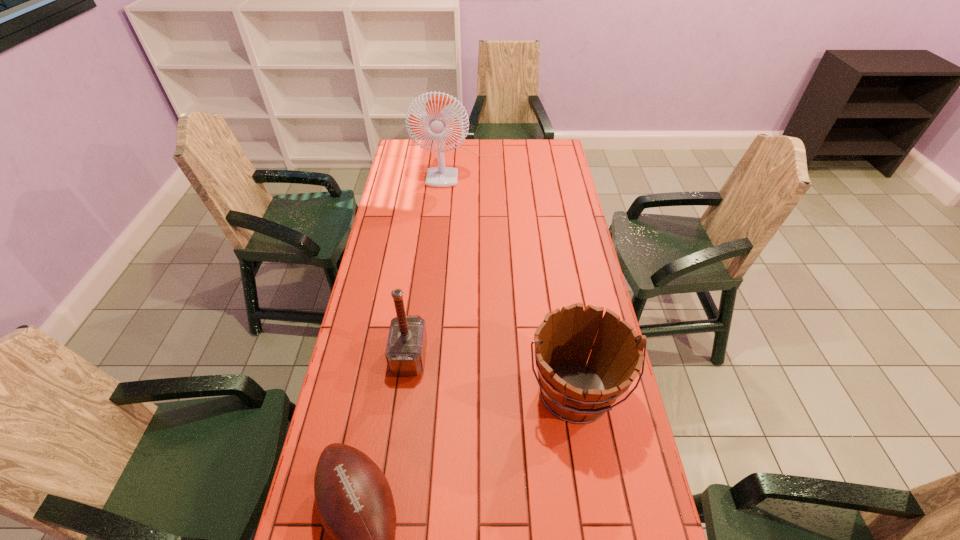
At what (x,y) coordinates should I click in order to perform the action: click on object present at the right edge. Please return your answer as a coordinate pair (x, y). This screenshot has height=540, width=960. Looking at the image, I should click on (576, 391).

You are a GUI agent. You are given a task and a screenshot of the screen. Output one action in this format:
    pyautogui.click(x=<x>, y=<y>)
    Task: Click on the object that is at the far left corner
    The height and width of the screenshot is (540, 960).
    Given the screenshot: What is the action you would take?
    pyautogui.click(x=441, y=176)

Identify the location of vacant space at the far edge of the desktop. (511, 143).

Locate an element on the screen. free space at the left edge of the desktop is located at coordinates (383, 248).

In the image, there is a desktop. In order to click on vacant space at the right edge in this screenshot , I will do `click(549, 228)`.

Identify the location of blank area at the far left corner. This screenshot has height=540, width=960. (399, 154).

You are a GUI agent. You are given a task and a screenshot of the screen. Output one action in this format:
    pyautogui.click(x=<x>, y=<y>)
    Task: Click on the free space at the far right corner of the desktop
    This screenshot has height=540, width=960.
    Given the screenshot: What is the action you would take?
    pyautogui.click(x=539, y=164)

The width and height of the screenshot is (960, 540). I want to click on free spot between the wine bucket and the tallest object, so click(516, 280).

Locate an element on the screen. free space that is in between the hammer and the rightmost object is located at coordinates (492, 375).

Choose which object is the third nearest neighbor to the rightmost object. Please provide its 2D coordinates. Your answer should be formatted as a tuple, i.e. [(x, y)], where the tuple contains the x and y coordinates of a point satisfying the conditions above.

[(441, 176)]